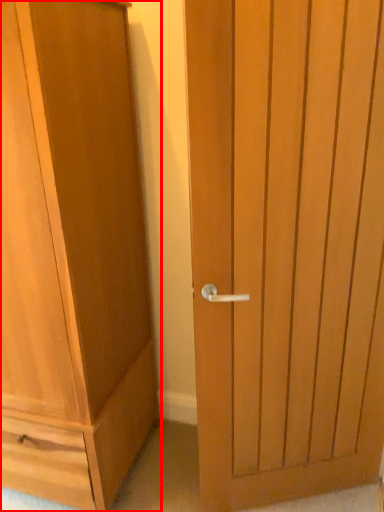
Question: Where is cupboard (annotated by the red box) located in relation to door in the image?

Choices:
 (A) right
 (B) left

Answer: (B)